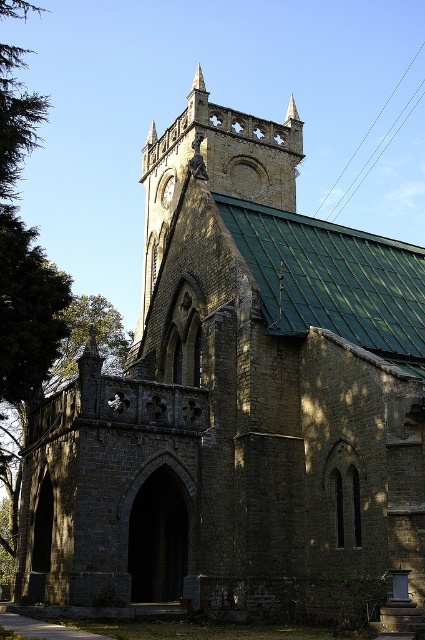
Between green leafy tree at left and gold textured clock at upper center, which one is positioned lower?

green leafy tree at left

Which of these two, green leafy tree at left or gold textured clock at upper center, stands shorter?

Standing shorter between the two is gold textured clock at upper center.

The height and width of the screenshot is (640, 425). Describe the element at coordinates (85, 339) in the screenshot. I see `green leafy tree at left` at that location.

Locate an element on the screen. This screenshot has width=425, height=640. green leafy tree at left is located at coordinates (85, 339).